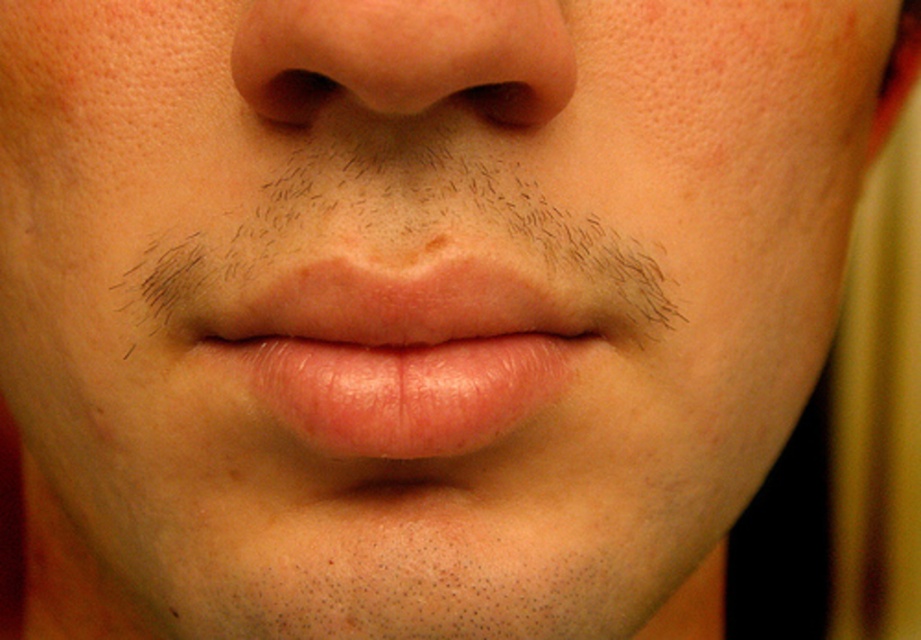
Who is lower down, smooth skin nose at center or black matte eye at upper center?

black matte eye at upper center

Locate an element on the screen. The image size is (921, 640). smooth skin nose at center is located at coordinates (404, 58).

Is brown hair at center thinner than pink smooth lips at center?

Incorrect, brown hair at center's width is not less than pink smooth lips at center's.

Which is more to the right, brown hair at center or pink smooth lips at center?

pink smooth lips at center

Between point (389, 244) and point (444, 298), which one is positioned behind?

The point (389, 244) is more distant.

Identify the location of brown hair at center. click(x=397, y=253).

Does brown hair at center appear on the right side of black matte eye at upper center?

No, brown hair at center is not to the right of black matte eye at upper center.

Consider the image. Can you confirm if brown hair at center is wider than black matte eye at upper center?

Correct, the width of brown hair at center exceeds that of black matte eye at upper center.

Is point (212, 260) less distant than point (475, 84)?

No, (212, 260) is further to viewer.

You are a GUI agent. You are given a task and a screenshot of the screen. Output one action in this format:
    pyautogui.click(x=<x>, y=<y>)
    Task: Click on the brown hair at center
    
    Given the screenshot: What is the action you would take?
    pyautogui.click(x=397, y=253)